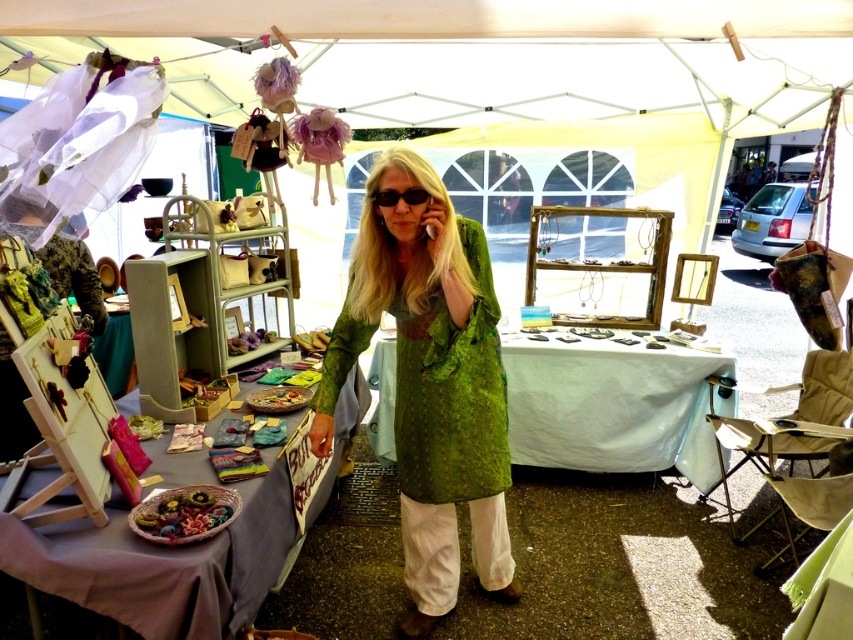
Question: Which point is closer to the camera?

Choices:
 (A) green textured dress at center
 (B) black plastic goggles at center

Answer: (A)

Question: Is the position of green textured dress at center less distant than that of black plastic goggles at center?

Choices:
 (A) yes
 (B) no

Answer: (A)

Question: Observing the image, what is the correct spatial positioning of green textured dress at center in reference to black plastic goggles at center?

Choices:
 (A) above
 (B) below

Answer: (B)

Question: Can you confirm if green textured dress at center is smaller than black plastic goggles at center?

Choices:
 (A) yes
 (B) no

Answer: (B)